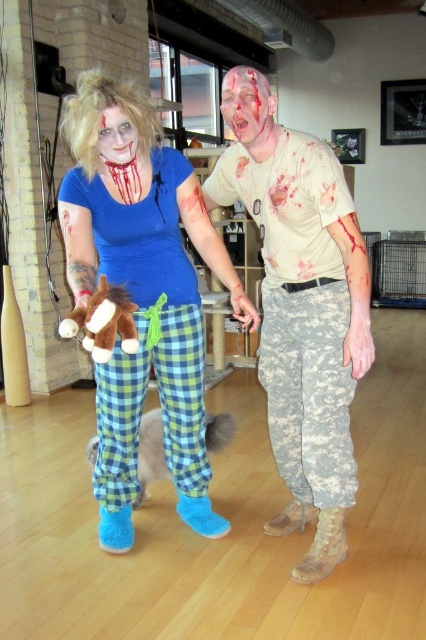
You are standing in front of a group of people dressed in zombie costumes. You need to locate the blue flannel pajama pants at center. What are their coordinates?

The coordinates of the blue flannel pajama pants at center are at point (232,305).

What is the 2D coordinate of the blue flannel pajama pants at center?

The blue flannel pajama pants at center are located at the 2D coordinate point of (x=232, y=305).

You are organizing a costume party and need to ensure all items fit into a storage box. The blue flannel pajama pants at center and the brown plush toy at center must be placed side by side. Which item requires more horizontal space?

The blue flannel pajama pants at center requires more horizontal space because its width surpasses that of the brown plush toy at center.